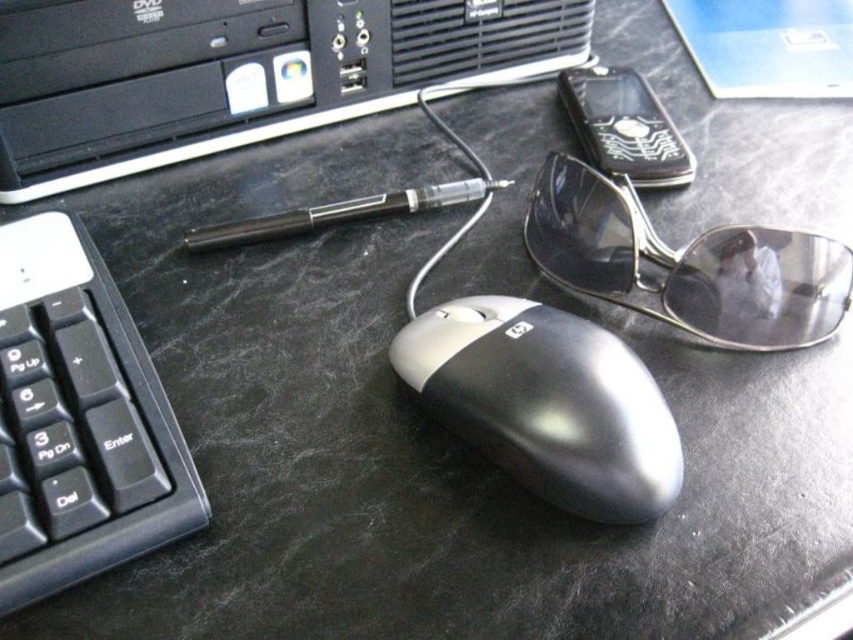
Based on the photo, you are setting up a new monitor and need to place it on the desk. The monitor stand requires at least 2 inches of space between the back of the monitor and any objects. Given the positions of the black plastic computer tower at upper left and the black plastic keyboard at lower left, can you determine if there is enough space between them to place the monitor stand?

The black plastic computer tower at upper left is not as tall as the black plastic keyboard at lower left, so the vertical distance between them may be sufficient. However, the horizontal distance isn not specified, so it is unclear if there is enough space between them to place the monitor stand.